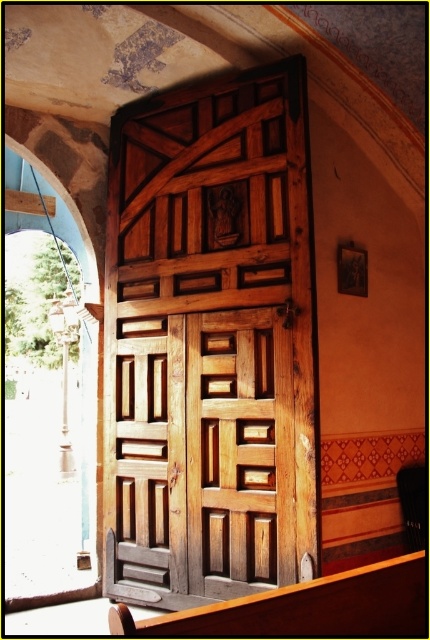
Question: Is natural wood door at center above wooden polished bench at lower center?

Choices:
 (A) yes
 (B) no

Answer: (A)

Question: Which point is closer to the camera taking this photo?

Choices:
 (A) (206, 612)
 (B) (297, 284)

Answer: (A)

Question: Does natural wood door at center have a smaller size compared to wooden polished bench at lower center?

Choices:
 (A) yes
 (B) no

Answer: (B)

Question: In this image, where is natural wood door at center located relative to wooden polished bench at lower center?

Choices:
 (A) right
 (B) left

Answer: (B)

Question: Which point appears closest to the camera in this image?

Choices:
 (A) pos(294,484)
 (B) pos(365,589)

Answer: (B)

Question: Which object is closer to the camera taking this photo?

Choices:
 (A) natural wood door at center
 (B) wooden polished bench at lower center

Answer: (B)